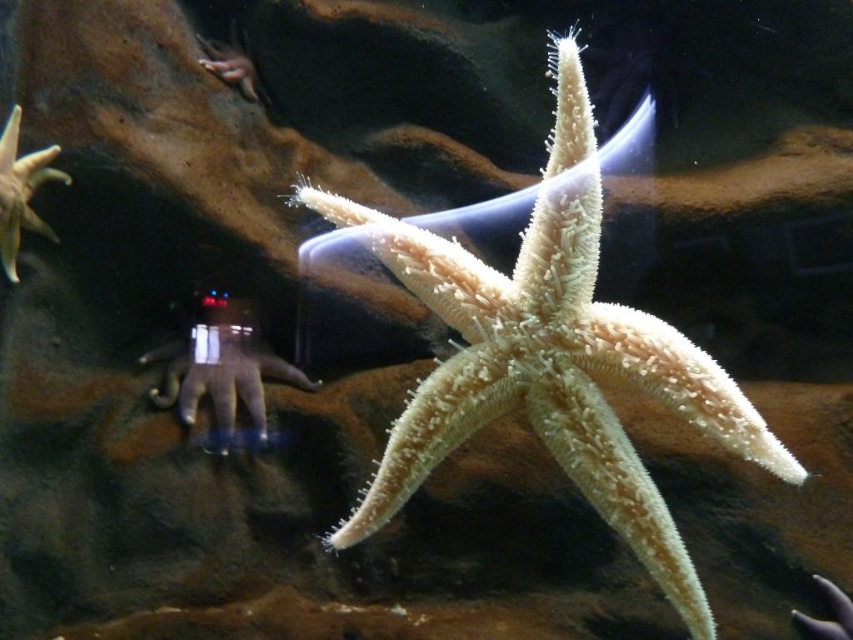
Can you confirm if sandy beige starfish at center is positioned to the right of smooth beige starfish at left?

Yes, sandy beige starfish at center is to the right of smooth beige starfish at left.

What are the coordinates of `sandy beige starfish at center` in the screenshot? It's located at (550, 356).

The height and width of the screenshot is (640, 853). Identify the location of sandy beige starfish at center. (x=550, y=356).

Can you confirm if sandy beige starfish at center is wider than metallic silver robot at lower center?

Yes, sandy beige starfish at center is wider than metallic silver robot at lower center.

Does sandy beige starfish at center have a greater height compared to metallic silver robot at lower center?

Yes, sandy beige starfish at center is taller than metallic silver robot at lower center.

The height and width of the screenshot is (640, 853). What do you see at coordinates (550, 356) in the screenshot?
I see `sandy beige starfish at center` at bounding box center [550, 356].

You are a GUI agent. You are given a task and a screenshot of the screen. Output one action in this format:
    pyautogui.click(x=<x>, y=<y>)
    Task: Click on the sandy beige starfish at center
    
    Given the screenshot: What is the action you would take?
    pyautogui.click(x=550, y=356)

Does point (221, 344) lie behind point (35, 157)?

Yes, it is.

Does metallic silver robot at lower center appear on the left side of smooth beige starfish at left?

Incorrect, metallic silver robot at lower center is not on the left side of smooth beige starfish at left.

Is point (175, 342) more distant than point (47, 177)?

Yes, point (175, 342) is farther from viewer.

You are a GUI agent. You are given a task and a screenshot of the screen. Output one action in this format:
    pyautogui.click(x=<x>, y=<y>)
    Task: Click on the metallic silver robot at lower center
    The width and height of the screenshot is (853, 640).
    Given the screenshot: What is the action you would take?
    pyautogui.click(x=221, y=365)